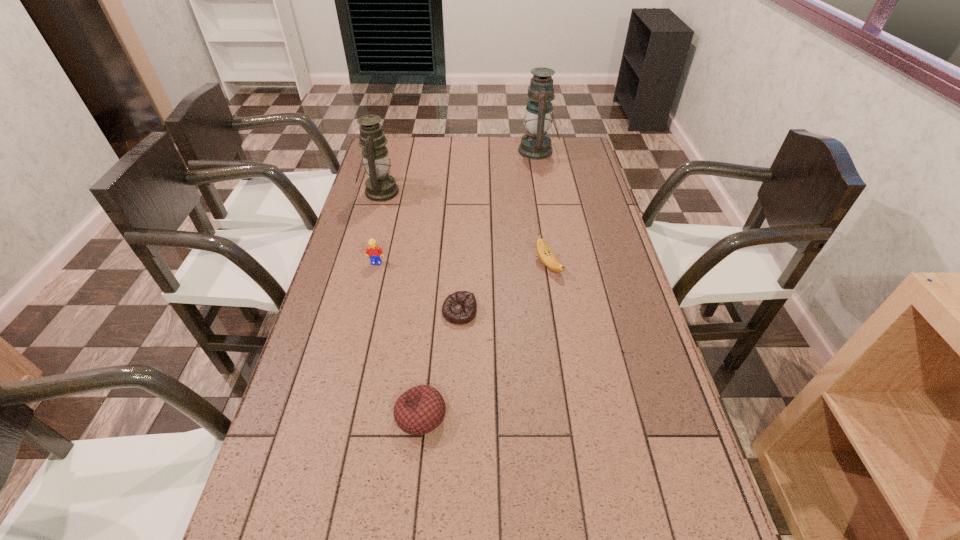
Locate an element on the screen. The width and height of the screenshot is (960, 540). free region located 0.260m on the front of the farther oil lamp is located at coordinates (546, 202).

Where is `free location located on the back of the nearer oil lamp`? This screenshot has height=540, width=960. free location located on the back of the nearer oil lamp is located at coordinates (388, 166).

What are the coordinates of `free space located 0.290m on the front-facing side of the Lego` in the screenshot? It's located at (358, 339).

At what (x,y) coordinates should I click in order to perform the action: click on vacant space located 0.210m on the back of the banana. Please return your answer as a coordinate pair (x, y). The image size is (960, 540). Looking at the image, I should click on (540, 213).

Where is `free space located 0.140m on the front of the nearer beanbag`? The image size is (960, 540). free space located 0.140m on the front of the nearer beanbag is located at coordinates (412, 508).

Find the location of a particular element. The width and height of the screenshot is (960, 540). free region located on the right of the shortest object is located at coordinates (509, 312).

Locate an element on the screen. object that is positioned at the far edge is located at coordinates (536, 145).

The image size is (960, 540). Identify the location of oil lamp situated at the left edge. click(380, 186).

Identify the location of Lego at the left edge. Image resolution: width=960 pixels, height=540 pixels. (374, 252).

The height and width of the screenshot is (540, 960). What are the coordinates of `object located in the right edge section of the desktop` in the screenshot? It's located at (536, 145).